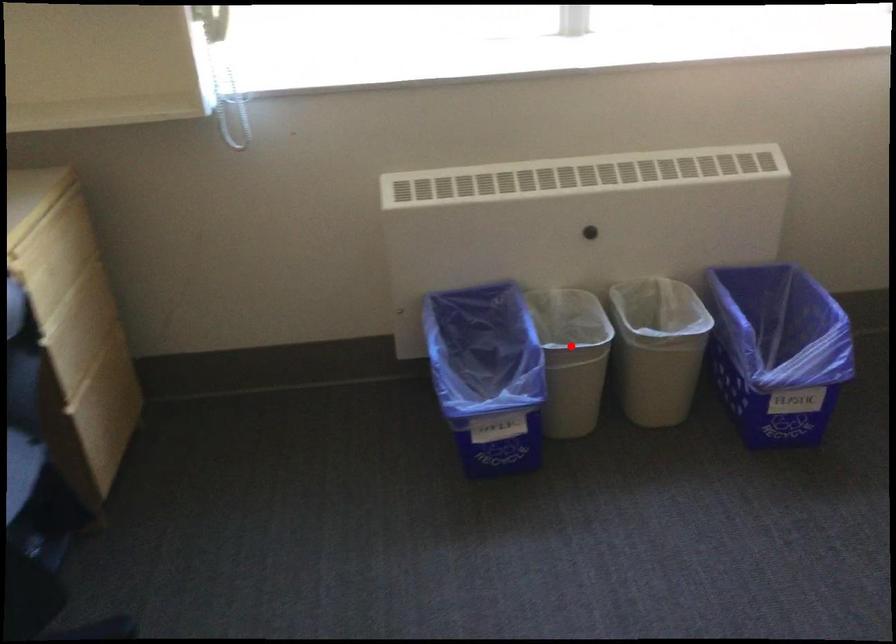
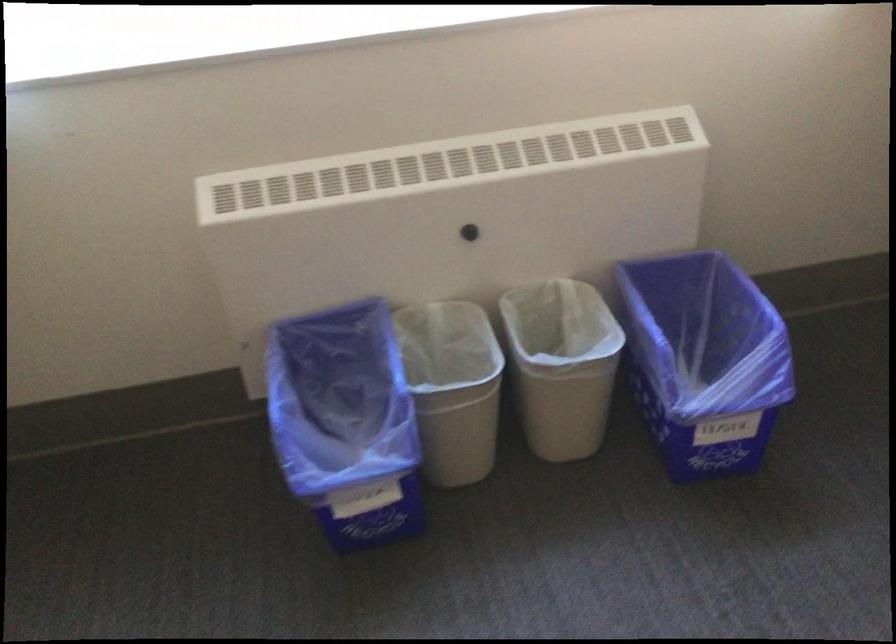
Question: I am providing you with two images of the same scene from different viewpoints. Image1 has a red point marked. In image2, the corresponding 3D location appears at what relative position? Reply with the corresponding letter.

Choices:
 (A) Closer
 (B) Farther

Answer: (A)